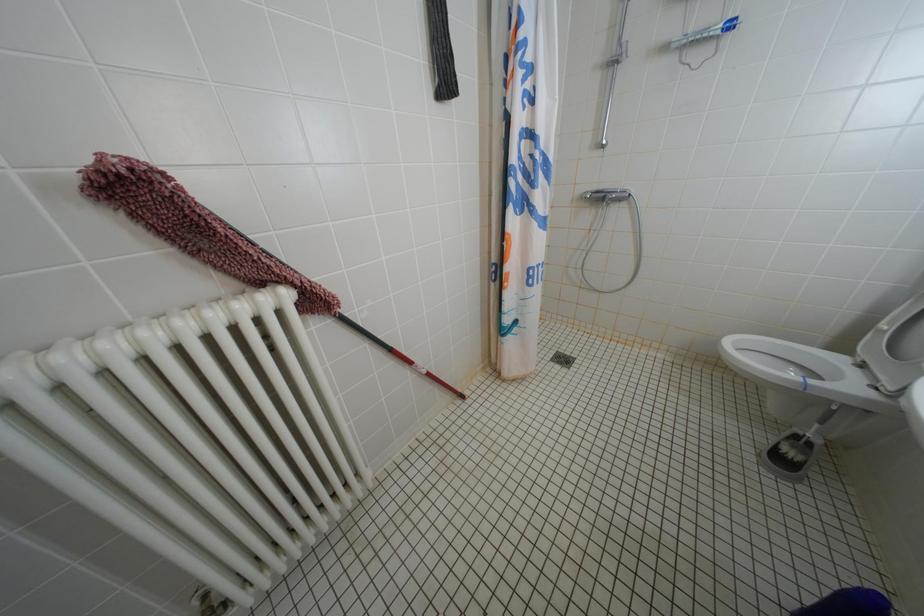
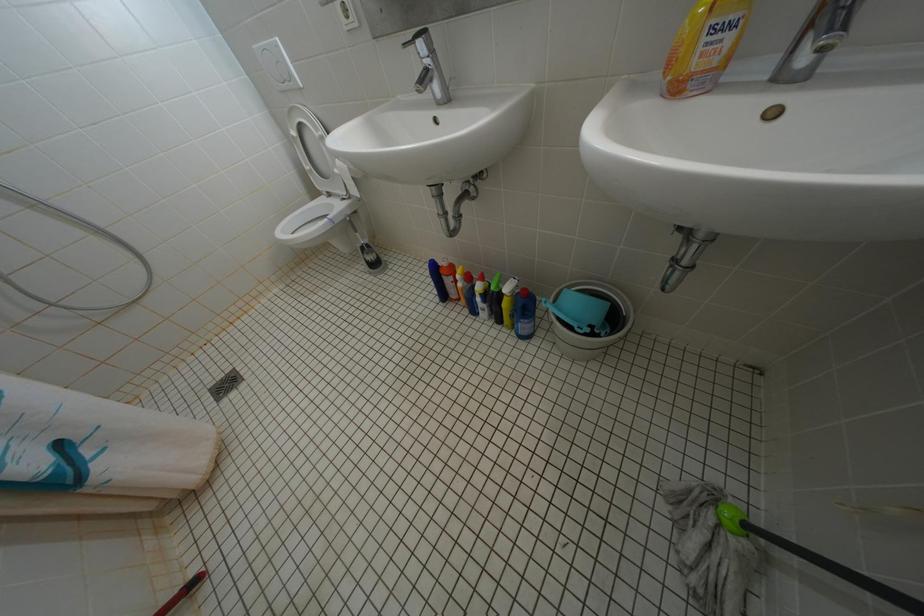
Based on the continuous images, in which direction is the camera rotating?

The rotation direction of the camera is right-down.